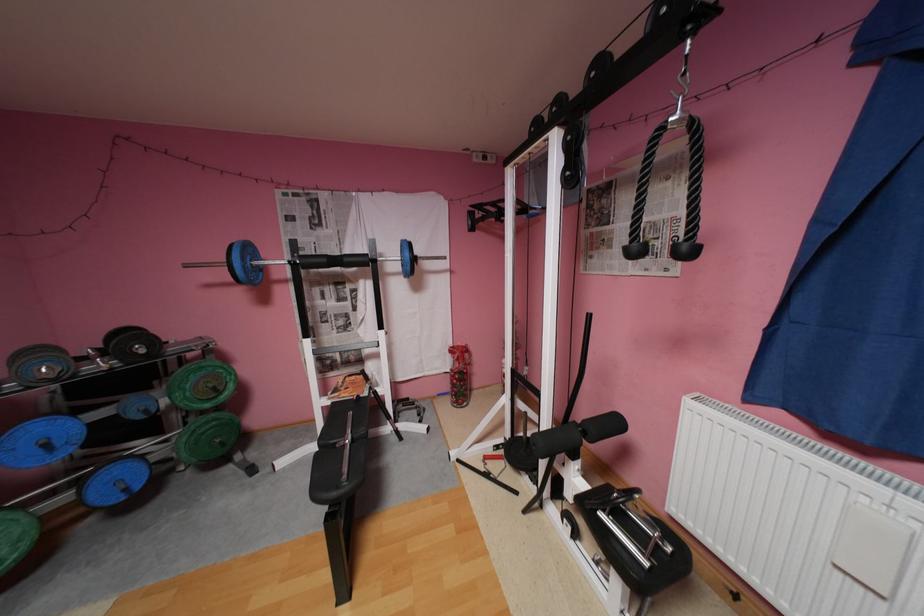
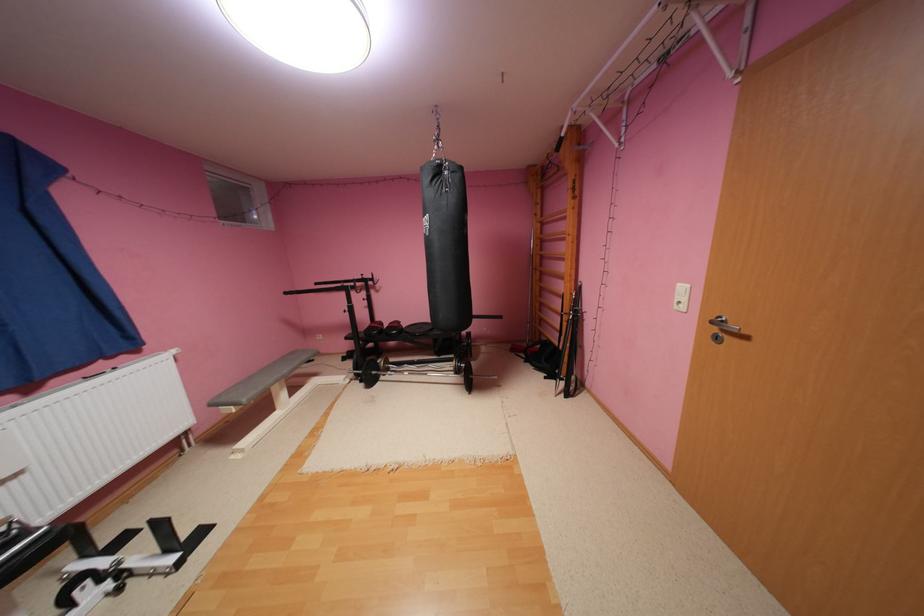
Locate, in the second image, the point that corresponds to [849,568] in the first image.

(11, 483)